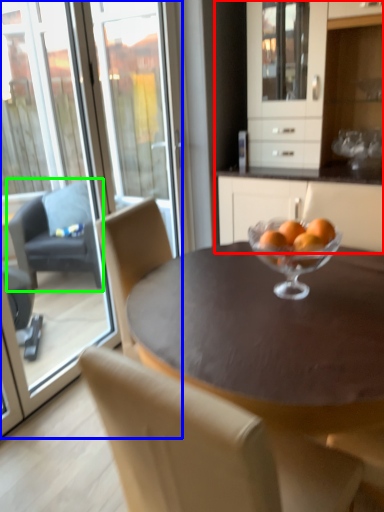
Question: Which object is the closest to the cabinetry (highlighted by a red box)? Choose among these: screen door (highlighted by a blue box) or chair (highlighted by a green box).

Choices:
 (A) screen door
 (B) chair

Answer: (B)